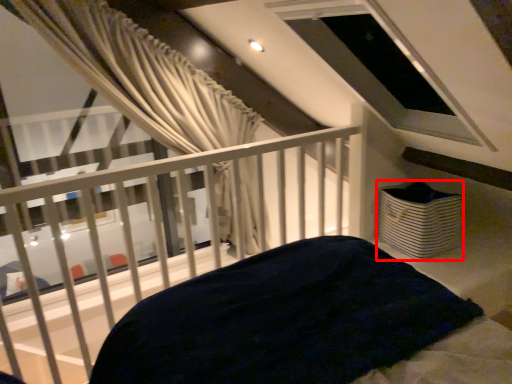
Question: Where is basket (annotated by the red box) located in relation to balcony in the image?

Choices:
 (A) right
 (B) left

Answer: (A)